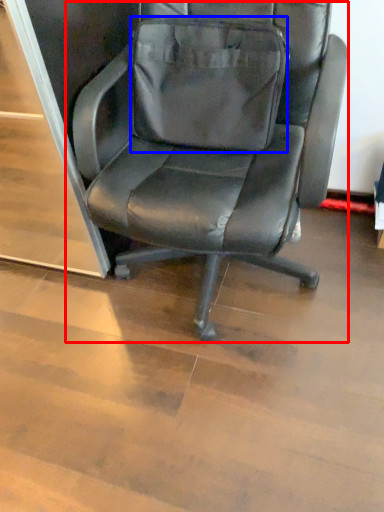
Question: Which object is closer to the camera taking this photo, chair (highlighted by a red box) or messenger bag (highlighted by a blue box)?

Choices:
 (A) chair
 (B) messenger bag

Answer: (A)